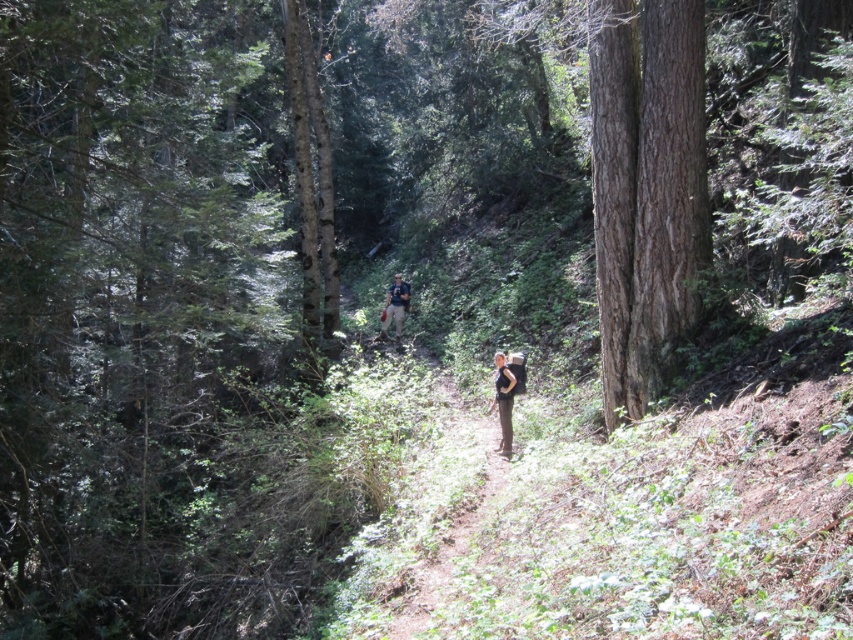
You are a hiker on the narrow dirt path in the forest. You notice two items at the center of your view. Which item is closer to you between the dark brown leather pants at center and the camouflage fabric backpack at center?

The dark brown leather pants at center is in front of the camouflage fabric backpack at center, so it is closer to you.